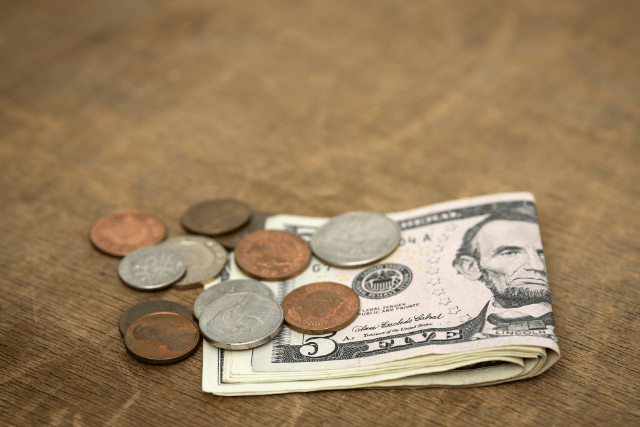
Find the location of a particular element. coin that is on top of table is located at coordinates (130, 231), (141, 266), (196, 262), (211, 226), (250, 227), (132, 312), (145, 330), (208, 296).